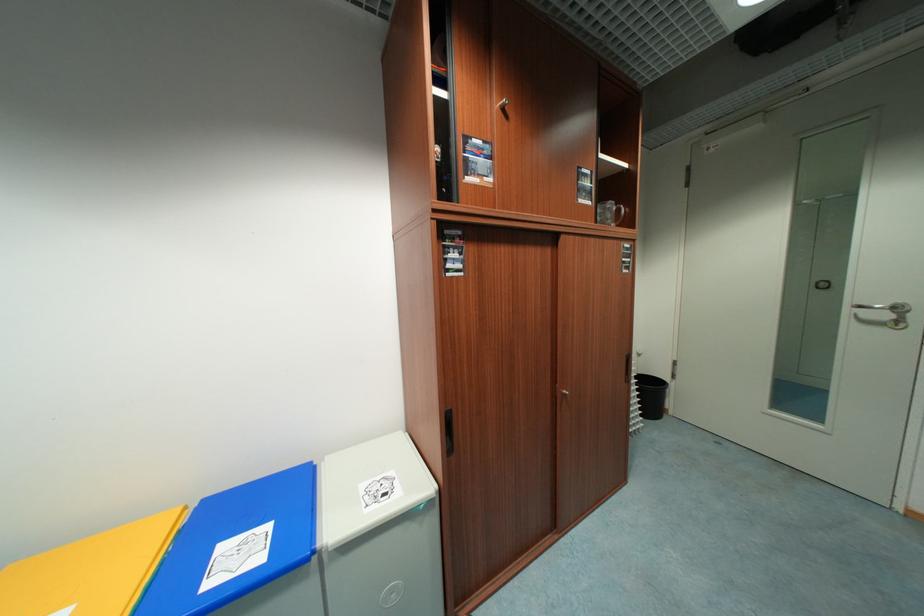
In order to click on glass pitcher in this screenshot , I will do `click(610, 213)`.